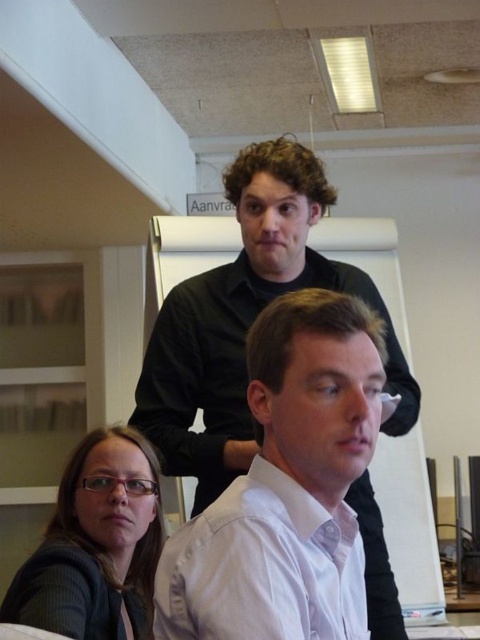
Is point (196, 368) in front of point (111, 624)?

No, it is not.

Can you confirm if black matte shirt at upper center is smaller than matte black glasses at lower left?

No, black matte shirt at upper center is not smaller than matte black glasses at lower left.

Who is more distant from viewer, (286, 269) or (123, 541)?

Point (286, 269)

Identify the location of black matte shirt at upper center. This screenshot has height=640, width=480. (245, 321).